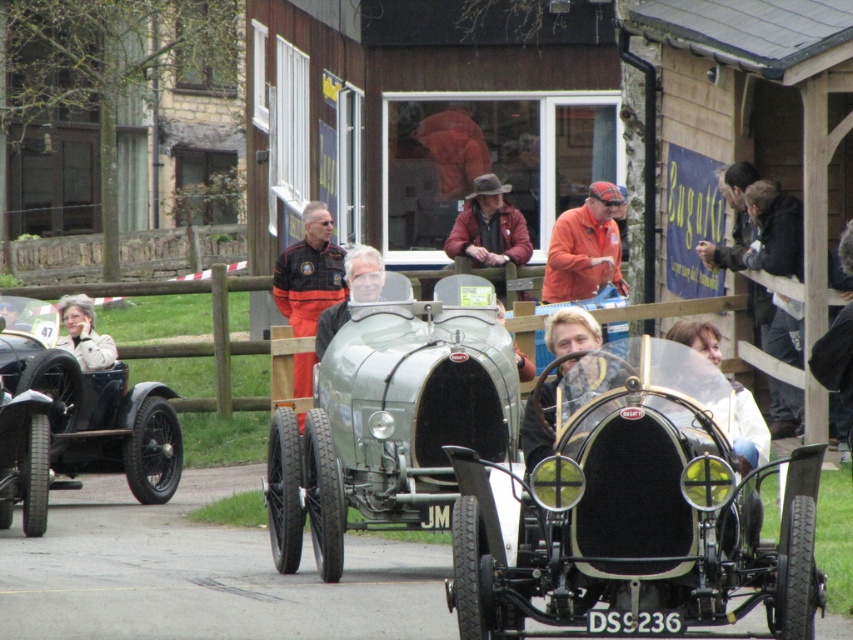
Question: Which object is the farthest from the orange fabric jacket at center?

Choices:
 (A) white leather jacket at center
 (B) light beige jacket at left
 (C) orange softshell jacket at center
 (D) shiny silver car at center

Answer: (A)

Question: Is silver metallic race car at center to the right of silver metallic car at center from the viewer's perspective?

Choices:
 (A) yes
 (B) no

Answer: (A)

Question: Estimate the real-world distances between objects in this image. Which object is farther from the light beige jacket at left?

Choices:
 (A) leather jacket at center
 (B) shiny silver car at center
 (C) silver metallic race car at center

Answer: (B)

Question: Is shiny black car at left to the left of orange fabric jacket at center from the viewer's perspective?

Choices:
 (A) no
 (B) yes

Answer: (B)

Question: Does leather jacket at center appear over shiny silver car at center?

Choices:
 (A) yes
 (B) no

Answer: (A)

Question: Which object is farther from the camera taking this photo?

Choices:
 (A) shiny chrome sidecar at center
 (B) orange softshell jacket at center
 (C) light beige leather jacket at left
 (D) leather jacket at center

Answer: (D)